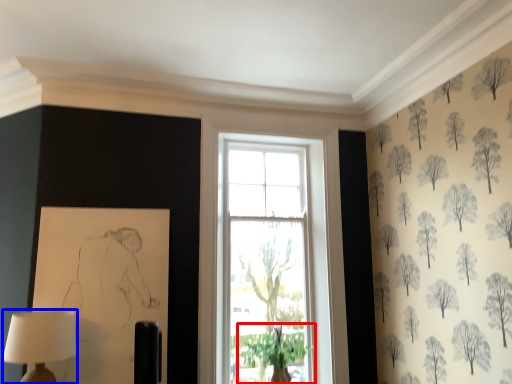
Question: Which point is closer to the camera, plant (highlighted by a red box) or table lamp (highlighted by a blue box)?

Choices:
 (A) plant
 (B) table lamp

Answer: (B)